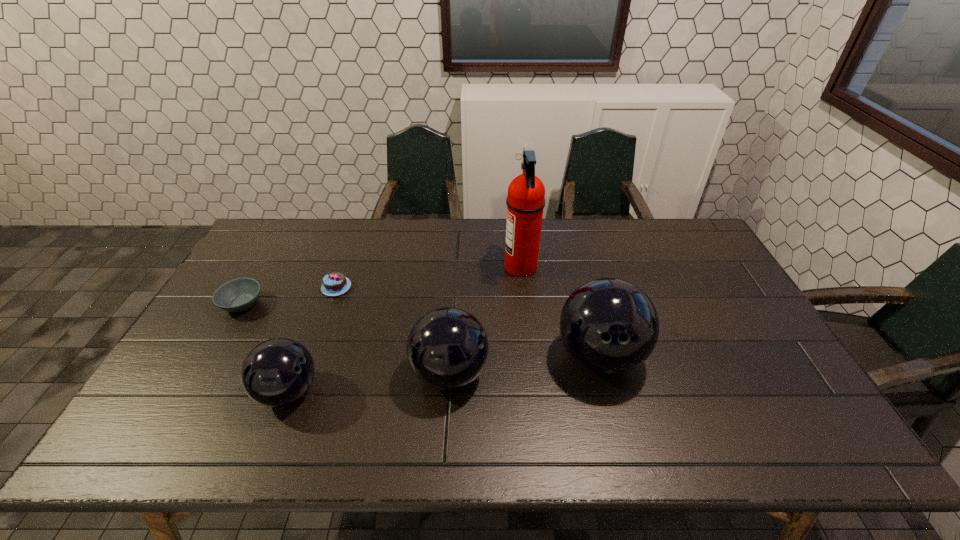
The image size is (960, 540). In the image, there is a desktop. Find the location of `blank space at the far edge`. blank space at the far edge is located at coordinates (348, 258).

In order to click on free space at the near edge of the desktop in this screenshot , I will do `click(318, 389)`.

You are a GUI agent. You are given a task and a screenshot of the screen. Output one action in this format:
    pyautogui.click(x=<x>, y=<y>)
    Task: Click on the vacant region at the left edge of the desktop
    This screenshot has width=960, height=540.
    Given the screenshot: What is the action you would take?
    pyautogui.click(x=227, y=380)

The width and height of the screenshot is (960, 540). I want to click on vacant space at the right edge, so click(x=725, y=318).

The height and width of the screenshot is (540, 960). I want to click on vacant space at the far left corner of the desktop, so click(306, 232).

Where is `free region at the near left corner of the desktop`? The width and height of the screenshot is (960, 540). free region at the near left corner of the desktop is located at coordinates (199, 386).

Find the location of a particular element. The width and height of the screenshot is (960, 540). empty space between the fourth shortest object and the tallest object is located at coordinates (485, 320).

Identify the location of vacant space that's between the second bowling ball from right to left and the tallest bowling ball. Image resolution: width=960 pixels, height=540 pixels. (525, 365).

Where is `vacant point located between the rightmost bowling ball and the second bowling ball from left to right`? This screenshot has width=960, height=540. vacant point located between the rightmost bowling ball and the second bowling ball from left to right is located at coordinates (525, 365).

What are the coordinates of `vacant space that's between the second shortest bowling ball and the fifth object from left to right` in the screenshot? It's located at (485, 320).